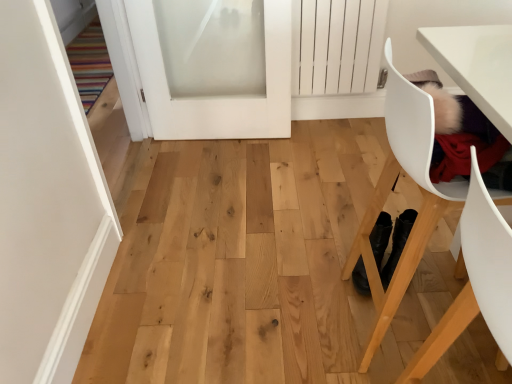
Question: Can you confirm if white frosted glass door at upper center, the second door positioned from the left, is bigger than white plastic chair at lower right, the second chair in the back-to-front sequence?

Choices:
 (A) no
 (B) yes

Answer: (B)

Question: Can you confirm if white frosted glass door at upper center, the second door positioned from the left, is positioned to the left of white plastic chair at lower right, the 1th chair viewed from the front?

Choices:
 (A) yes
 (B) no

Answer: (A)

Question: From a real-world perspective, is white frosted glass door at upper center, the second door positioned from the left, located beneath white plastic chair at lower right, the second chair in the back-to-front sequence?

Choices:
 (A) yes
 (B) no

Answer: (A)

Question: Does white frosted glass door at upper center, acting as the first door starting from the right, come in front of white plastic chair at lower right, the second chair in the back-to-front sequence?

Choices:
 (A) yes
 (B) no

Answer: (B)

Question: Can you confirm if white frosted glass door at upper center, the second door positioned from the left, is wider than white plastic chair at lower right, the 1th chair viewed from the front?

Choices:
 (A) no
 (B) yes

Answer: (A)

Question: Can you confirm if white frosted glass door at upper center, acting as the first door starting from the right, is smaller than white plastic chair at lower right, the 1th chair viewed from the front?

Choices:
 (A) yes
 (B) no

Answer: (B)

Question: Does white plastic chair at lower right, the 1th chair viewed from the front, have a larger size compared to white frosted glass door at upper center, acting as the first door starting from the right?

Choices:
 (A) no
 (B) yes

Answer: (A)

Question: Is white plastic chair at lower right, the 1th chair viewed from the front, positioned in front of white frosted glass door at upper center, acting as the first door starting from the right?

Choices:
 (A) yes
 (B) no

Answer: (A)

Question: Is white plastic chair at lower right, the 1th chair viewed from the front, not within white frosted glass door at upper center, the second door positioned from the left?

Choices:
 (A) no
 (B) yes

Answer: (B)

Question: Is white plastic chair at lower right, the second chair in the back-to-front sequence, further to camera compared to white frosted glass door at upper center, acting as the first door starting from the right?

Choices:
 (A) yes
 (B) no

Answer: (B)

Question: From a real-world perspective, is white plastic chair at lower right, the 1th chair viewed from the front, under white frosted glass door at upper center, acting as the first door starting from the right?

Choices:
 (A) yes
 (B) no

Answer: (B)

Question: Can you confirm if white plastic chair at lower right, the second chair in the back-to-front sequence, is smaller than white frosted glass door at upper center, the second door positioned from the left?

Choices:
 (A) no
 (B) yes

Answer: (B)

Question: Is white matte door at upper left, the 2th door from the right, directly adjacent to white plastic chair at right, the 1th chair positioned from the back?

Choices:
 (A) yes
 (B) no

Answer: (B)